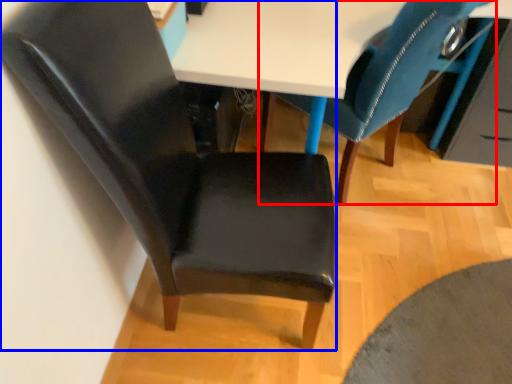
Question: Which point is further to the camera, chair (highlighted by a red box) or chair (highlighted by a blue box)?

Choices:
 (A) chair
 (B) chair

Answer: (A)